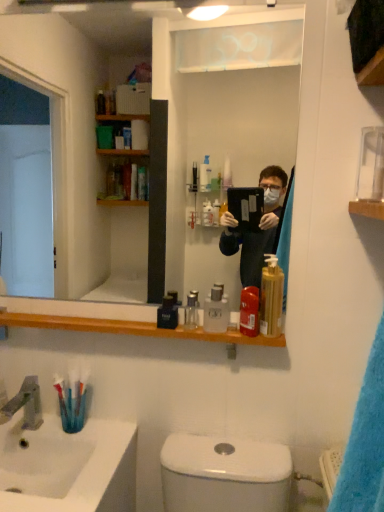
In order to face black glossy bottle at center, which is the 1th mouthwash in left-to-right order, should I rotate leftwards or rightwards?

A 3.116 degree turn to the left will do.

At what (x,y) coordinates should I click in order to perform the action: click on clear plastic bottle at center, which ranks as the 2th mouthwash in right-to-left order. Please return your answer as a coordinate pair (x, y). Looking at the image, I should click on (x=216, y=310).

I want to click on translucent plastic toothbrush at lower left, so click(72, 397).

At what (x,y) coordinates should I click in order to perform the action: click on satin nickel faucet at sink left. Please return your answer as a coordinate pair (x, y). Looking at the image, I should click on (25, 404).

How different are the orientations of translucent plastic mouthwash at shelf center, the first mouthwash from the right, and satin nickel faucet at sink left in degrees?

The facing directions of translucent plastic mouthwash at shelf center, the first mouthwash from the right, and satin nickel faucet at sink left are 2.17 degrees apart.

Can we say translucent plastic mouthwash at shelf center, the fourth mouthwash positioned from the left, lies outside satin nickel faucet at sink left?

Yes.

Looking at this image, which of these two, translucent plastic mouthwash at shelf center, the first mouthwash from the right, or satin nickel faucet at sink left, is smaller?

translucent plastic mouthwash at shelf center, the first mouthwash from the right.

Considering the points (257, 303) and (38, 399), which point is behind, point (257, 303) or point (38, 399)?

The point (38, 399) is farther from the camera.

Which of these two, translucent plastic mouthwash at shelf center, the fourth mouthwash positioned from the left, or black glossy bottle at center, which is the 1th mouthwash in left-to-right order, stands shorter?

black glossy bottle at center, which is the 1th mouthwash in left-to-right order, is shorter.

Is translucent plastic mouthwash at shelf center, the fourth mouthwash positioned from the left, spatially inside black glossy bottle at center, which ranks as the fourth mouthwash in right-to-left order, or outside of it?

translucent plastic mouthwash at shelf center, the fourth mouthwash positioned from the left, is spatially situated outside black glossy bottle at center, which ranks as the fourth mouthwash in right-to-left order.

Find the location of `the 2nd mouthwash below the translucent plastic mouthwash at shelf center, the first mouthwash from the right (from a real-world perspective)`. the 2nd mouthwash below the translucent plastic mouthwash at shelf center, the first mouthwash from the right (from a real-world perspective) is located at coordinates (168, 312).

Between point (248, 300) and point (174, 328), which one is positioned behind?

The point (174, 328) is more distant.

Could you measure the distance between clear glass mirror at upper center and translucent plastic toothbrush at lower left?

clear glass mirror at upper center is 5.78 feet away from translucent plastic toothbrush at lower left.

Considering the relative positions of clear glass mirror at upper center and translucent plastic toothbrush at lower left in the image provided, is clear glass mirror at upper center to the right of translucent plastic toothbrush at lower left from the viewer's perspective?

Correct, you'll find clear glass mirror at upper center to the right of translucent plastic toothbrush at lower left.

From a real-world perspective, is clear glass mirror at upper center physically located above or below translucent plastic toothbrush at lower left?

clear glass mirror at upper center is situated higher than translucent plastic toothbrush at lower left in the real world.

Considering their positions, is clear glass mirror at upper center located in front of or behind translucent plastic toothbrush at lower left?

clear glass mirror at upper center is in front of translucent plastic toothbrush at lower left.

Which object is positioned more to the left, clear glass mirror at upper center or translucent plastic mouthwash at shelf center, the fourth mouthwash positioned from the left?

clear glass mirror at upper center is more to the left.

Consider the image. Considering the relative sizes of clear glass mirror at upper center and translucent plastic mouthwash at shelf center, the first mouthwash from the right, in the image provided, is clear glass mirror at upper center smaller than translucent plastic mouthwash at shelf center, the first mouthwash from the right,?

No, clear glass mirror at upper center is not smaller than translucent plastic mouthwash at shelf center, the first mouthwash from the right.

Does clear glass mirror at upper center have a greater height compared to translucent plastic mouthwash at shelf center, the first mouthwash from the right?

Correct, clear glass mirror at upper center is much taller as translucent plastic mouthwash at shelf center, the first mouthwash from the right.

From a real-world perspective, which object stands above the other?

clear glass mirror at upper center is physically above.

Is white glossy sink at lower left oriented away from translucent plastic mouthwash at shelf center, the first mouthwash from the right?

white glossy sink at lower left does not have its back to translucent plastic mouthwash at shelf center, the first mouthwash from the right.

Is white glossy sink at lower left wider than translucent plastic mouthwash at shelf center, the first mouthwash from the right?

Indeed, white glossy sink at lower left has a greater width compared to translucent plastic mouthwash at shelf center, the first mouthwash from the right.

Between white glossy sink at lower left and translucent plastic mouthwash at shelf center, the first mouthwash from the right, which one has larger size?

white glossy sink at lower left.

Which of these two, white glossy sink at lower left or translucent plastic mouthwash at shelf center, the fourth mouthwash positioned from the left, stands shorter?

Standing shorter between the two is translucent plastic mouthwash at shelf center, the fourth mouthwash positioned from the left.

In the scene shown: Can you tell me how much translucent plastic mouthwash at shelf center, the first mouthwash from the right, and clear plastic bottle at center, the 3th mouthwash in the left-to-right sequence, differ in facing direction?

The angle between the facing direction of translucent plastic mouthwash at shelf center, the first mouthwash from the right, and the facing direction of clear plastic bottle at center, the 3th mouthwash in the left-to-right sequence, is 0.00047 degrees.

From a real-world perspective, which mouthwash is the 1st one underneath the translucent plastic mouthwash at shelf center, the fourth mouthwash positioned from the left? Please provide its 2D coordinates.

[(216, 310)]

Which of these two, translucent plastic mouthwash at shelf center, the fourth mouthwash positioned from the left, or clear plastic bottle at center, the 3th mouthwash in the left-to-right sequence, stands taller?

With more height is translucent plastic mouthwash at shelf center, the fourth mouthwash positioned from the left.

Considering the positions of objects translucent plastic mouthwash at shelf center, the first mouthwash from the right, and clear plastic bottle at center, the 3th mouthwash in the left-to-right sequence, in the image provided, who is more to the left, translucent plastic mouthwash at shelf center, the first mouthwash from the right, or clear plastic bottle at center, the 3th mouthwash in the left-to-right sequence,?

Positioned to the left is clear plastic bottle at center, the 3th mouthwash in the left-to-right sequence.

Can you tell me how much satin nickel faucet at sink left and translucent plastic toothbrush at lower left differ in facing direction?

The angular difference between satin nickel faucet at sink left and translucent plastic toothbrush at lower left is 2.88 degrees.

Considering the relative positions of satin nickel faucet at sink left and translucent plastic toothbrush at lower left in the image provided, is satin nickel faucet at sink left to the left of translucent plastic toothbrush at lower left from the viewer's perspective?

Indeed, satin nickel faucet at sink left is positioned on the left side of translucent plastic toothbrush at lower left.

Does satin nickel faucet at sink left have a smaller size compared to translucent plastic toothbrush at lower left?

Incorrect, satin nickel faucet at sink left is not smaller in size than translucent plastic toothbrush at lower left.

From the image's perspective, is satin nickel faucet at sink left positioned above or below translucent plastic toothbrush at lower left?

Based on their image positions, satin nickel faucet at sink left is located beneath translucent plastic toothbrush at lower left.

I want to click on mouthwash in front of the satin nickel faucet at sink left, so click(x=249, y=311).

This screenshot has height=512, width=384. Identify the location of mouthwash that is the 2nd one above the black glossy bottle at center, which is the 1th mouthwash in left-to-right order (from a real-world perspective). (249, 311).

Based on their spatial positions, is white glossy sink at lower left or translucent plastic mouthwash at shelf center, the fourth mouthwash positioned from the left, further from clear glass mirror at upper center?

The object further to clear glass mirror at upper center is translucent plastic mouthwash at shelf center, the fourth mouthwash positioned from the left.

Looking at the image, which one is located further to translucent plastic toothbrush at lower left, satin nickel faucet at sink left or black glossy bottle at center, which is the 1th mouthwash in left-to-right order?

Based on the image, black glossy bottle at center, which is the 1th mouthwash in left-to-right order, appears to be further to translucent plastic toothbrush at lower left.

Which object lies nearer to the anchor point translucent plastic soap dispenser at shelf right, white glossy sink at lower left or satin nickel faucet at sink left?

Among the two, white glossy sink at lower left is located nearer to translucent plastic soap dispenser at shelf right.

From the image, which object appears to be nearer to black glossy bottle at center, which ranks as the fourth mouthwash in right-to-left order, white glossy sink at lower left or satin nickel faucet at sink left?

Among the two, white glossy sink at lower left is located nearer to black glossy bottle at center, which ranks as the fourth mouthwash in right-to-left order.

Considering their positions, is clear glass bottle at center, arranged as the second mouthwash when viewed from the left, positioned closer to clear plastic bottle at center, which ranks as the 2th mouthwash in right-to-left order, than translucent plastic toothbrush at lower left?

clear glass bottle at center, arranged as the second mouthwash when viewed from the left, is closer to clear plastic bottle at center, which ranks as the 2th mouthwash in right-to-left order.

Estimate the real-world distances between objects in this image. Which object is closer to satin nickel faucet at sink left, clear glass mirror at upper center or translucent plastic soap dispenser at shelf right?

Among the two, translucent plastic soap dispenser at shelf right is located nearer to satin nickel faucet at sink left.

Looking at the image, which one is located closer to clear glass mirror at upper center, translucent plastic toothbrush at lower left or satin nickel faucet at sink left?

translucent plastic toothbrush at lower left lies closer to clear glass mirror at upper center than the other object.

Based on their spatial positions, is clear glass bottle at center, arranged as the second mouthwash when viewed from the left, or satin nickel faucet at sink left further from translucent plastic mouthwash at shelf center, the fourth mouthwash positioned from the left?

Among the two, satin nickel faucet at sink left is located further to translucent plastic mouthwash at shelf center, the fourth mouthwash positioned from the left.

Where is `soap dispenser between clear glass mirror at upper center and satin nickel faucet at sink left vertically`? Image resolution: width=384 pixels, height=512 pixels. soap dispenser between clear glass mirror at upper center and satin nickel faucet at sink left vertically is located at coordinates (271, 297).

The height and width of the screenshot is (512, 384). Find the location of `toothbrush between clear plastic bottle at center, which ranks as the 2th mouthwash in right-to-left order, and white glossy sink at lower left in the up-down direction`. toothbrush between clear plastic bottle at center, which ranks as the 2th mouthwash in right-to-left order, and white glossy sink at lower left in the up-down direction is located at coordinates click(72, 397).

The width and height of the screenshot is (384, 512). I want to click on toothbrush situated between satin nickel faucet at sink left and translucent plastic soap dispenser at shelf right from left to right, so click(x=72, y=397).

Find the location of a particular element. soap dispenser between clear glass mirror at upper center and translucent plastic toothbrush at lower left in the up-down direction is located at coordinates click(x=271, y=297).